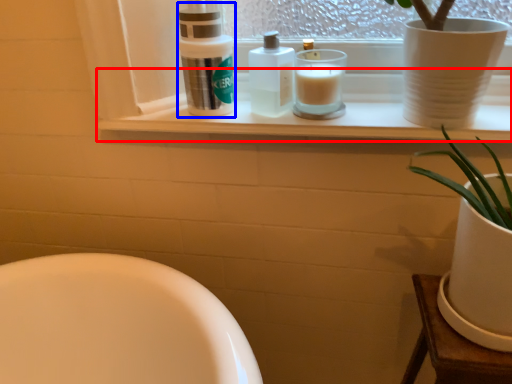
Question: Which object is further to the camera taking this photo, window sill (highlighted by a red box) or cleaning product (highlighted by a blue box)?

Choices:
 (A) window sill
 (B) cleaning product

Answer: (B)